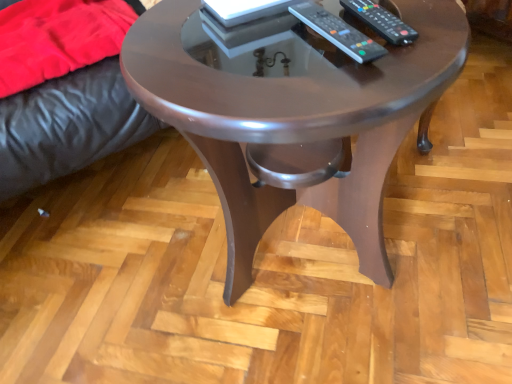
Image resolution: width=512 pixels, height=384 pixels. I want to click on free point in front of black plastic remote at center, which is the 2th remote from right to left, so click(x=343, y=89).